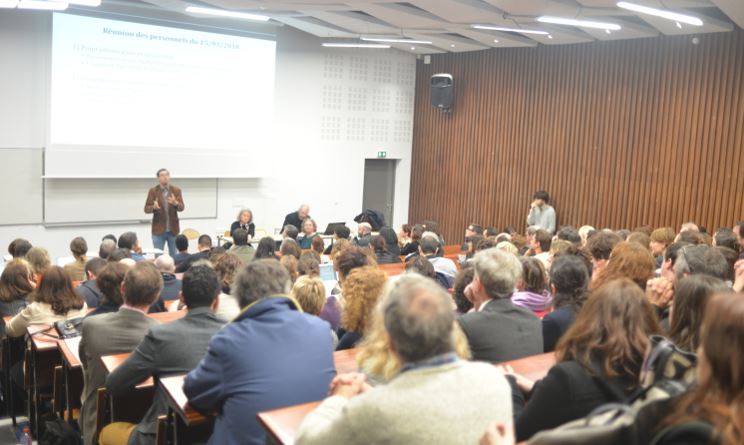
Identify the location of sound speaker on the ceiling. The height and width of the screenshot is (445, 744). (x=443, y=93).